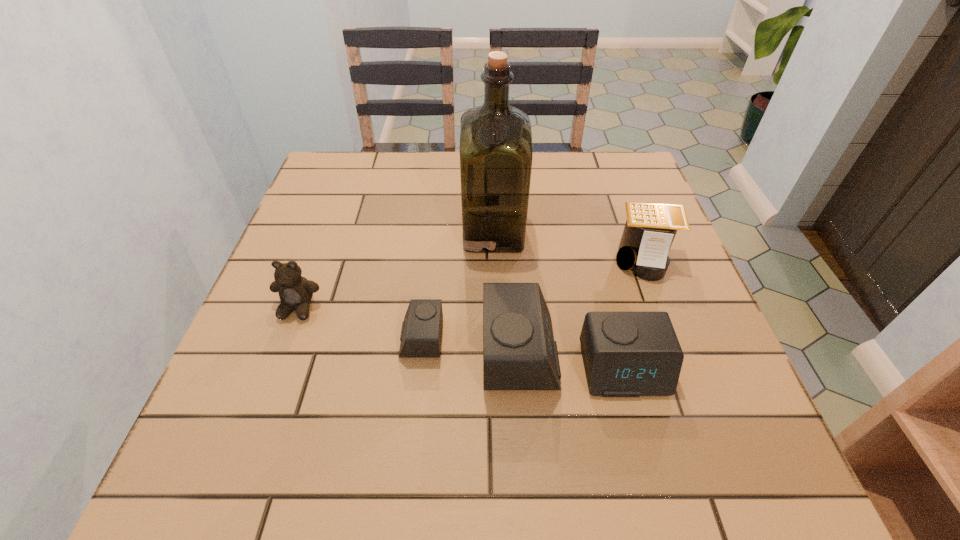
In the current image, all alarm clocks are evenly spaced. To maintain this equal spacing, where should an additional alarm clock be placed on the right? Please point out a free spot. Please provide its 2D coordinates. Your answer should be formatted as a tuple, i.e. [(x, y)], where the tuple contains the x and y coordinates of a point satisfying the conditions above.

[(734, 386)]